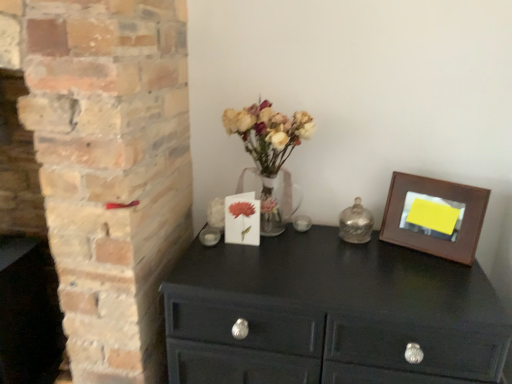
Question: Is brick fireplace at left in front of or behind matte black chest of drawers at center in the image?

Choices:
 (A) behind
 (B) front

Answer: (A)

Question: Visually, is brick fireplace at left positioned to the left or to the right of matte black chest of drawers at center?

Choices:
 (A) right
 (B) left

Answer: (B)

Question: Which is farther from the translucent glass vase at center?

Choices:
 (A) brown wooden picture frame at upper right
 (B) matte black chest of drawers at center
 (C) brick fireplace at left
 (D) shiny metallic bell at center-right

Answer: (C)

Question: Estimate the real-world distances between objects in this image. Which object is farther from the shiny metallic bell at center-right?

Choices:
 (A) brown wooden picture frame at upper right
 (B) matte black chest of drawers at center
 (C) translucent glass vase at center
 (D) brick fireplace at left

Answer: (D)